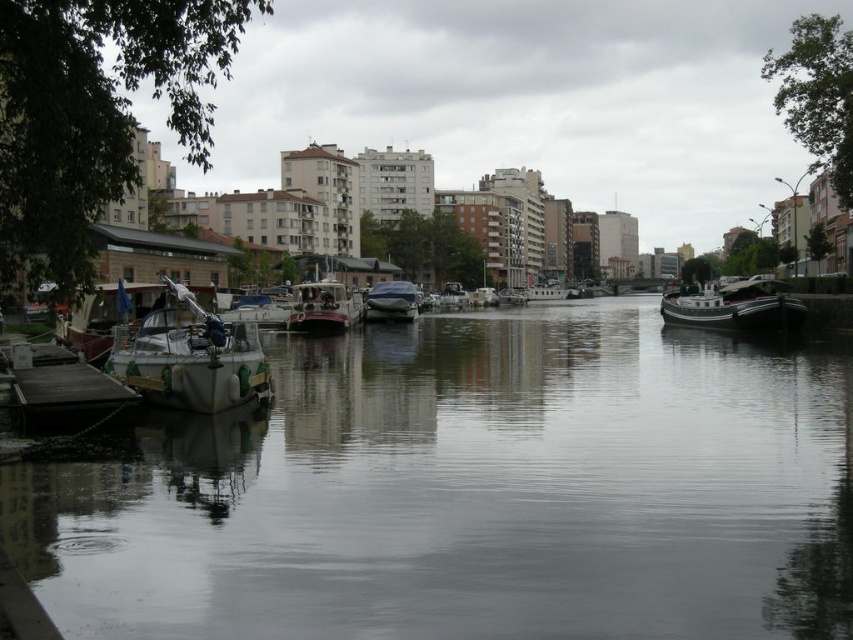
Question: From the image, what is the correct spatial relationship of white glossy boat at right in relation to metallic red boat at center?

Choices:
 (A) below
 (B) above

Answer: (B)

Question: Is white glossy boat at right to the right of shiny silver boat at center from the viewer's perspective?

Choices:
 (A) yes
 (B) no

Answer: (A)

Question: Which point is farther to the camera?

Choices:
 (A) (759, 316)
 (B) (126, 400)
 (C) (328, 296)
 (D) (762, 630)

Answer: (C)

Question: Does white glossy boat at right come behind shiny silver boat at center?

Choices:
 (A) yes
 (B) no

Answer: (B)

Question: Which is nearer to the metallic red boat at center?

Choices:
 (A) smooth water at center
 (B) white glossy boat at right

Answer: (A)

Question: Which point appears farthest from the camera in this image?

Choices:
 (A) (292, 330)
 (B) (403, 285)
 (C) (230, 317)

Answer: (B)